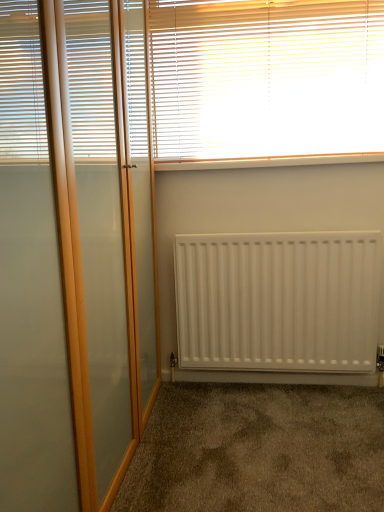
Question: Is white plastic window sill at upper center closer to camera compared to white wooden blinds at upper center?

Choices:
 (A) no
 (B) yes

Answer: (A)

Question: Does white plastic window sill at upper center appear on the left side of white wooden blinds at upper center?

Choices:
 (A) yes
 (B) no

Answer: (B)

Question: Considering the relative sizes of white plastic window sill at upper center and white wooden blinds at upper center in the image provided, is white plastic window sill at upper center bigger than white wooden blinds at upper center?

Choices:
 (A) yes
 (B) no

Answer: (B)

Question: Is the surface of white plastic window sill at upper center in direct contact with white wooden blinds at upper center?

Choices:
 (A) no
 (B) yes

Answer: (A)

Question: Is white plastic window sill at upper center oriented towards white wooden blinds at upper center?

Choices:
 (A) yes
 (B) no

Answer: (B)

Question: Considering the relative sizes of white plastic window sill at upper center and white wooden blinds at upper center in the image provided, is white plastic window sill at upper center thinner than white wooden blinds at upper center?

Choices:
 (A) no
 (B) yes

Answer: (A)

Question: Is white wooden blinds at upper center wider than white matte radiator at center?

Choices:
 (A) no
 (B) yes

Answer: (A)

Question: From a real-world perspective, is white wooden blinds at upper center located higher than white matte radiator at center?

Choices:
 (A) no
 (B) yes

Answer: (B)

Question: Is white wooden blinds at upper center aimed at white matte radiator at center?

Choices:
 (A) yes
 (B) no

Answer: (B)

Question: Does white wooden blinds at upper center come behind white matte radiator at center?

Choices:
 (A) no
 (B) yes

Answer: (A)

Question: Are white wooden blinds at upper center and white matte radiator at center making contact?

Choices:
 (A) yes
 (B) no

Answer: (B)

Question: Can we say white wooden blinds at upper center lies outside white matte radiator at center?

Choices:
 (A) yes
 (B) no

Answer: (A)

Question: Is brown carpet at lower center thinner than white matte radiator at center?

Choices:
 (A) no
 (B) yes

Answer: (A)